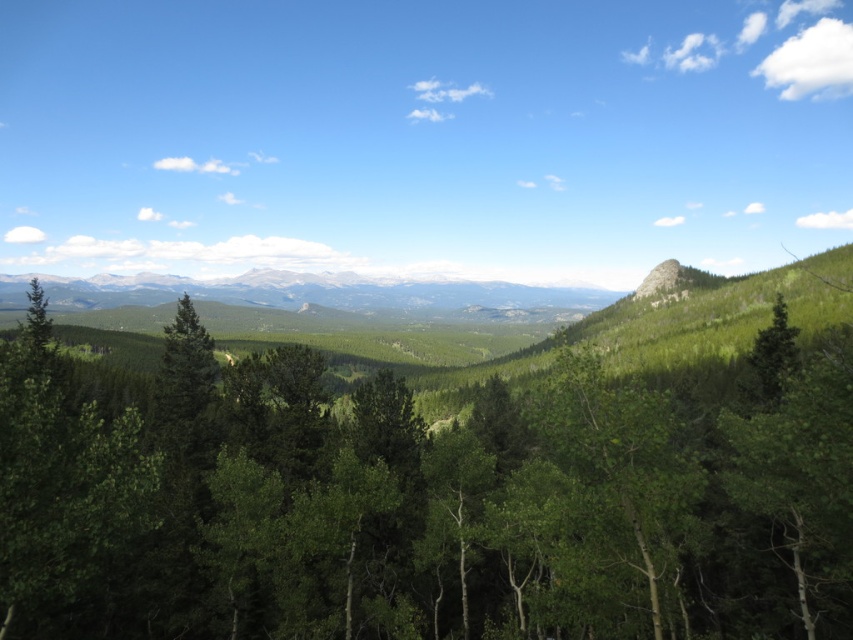
You are an ecologist studying tree distribution in the forest. You observe the green leafy tree at center and the green matte tree at right. Which tree is closer to you based on their positions in the scene?

The green leafy tree at center is closer to you because it is positioned in front of the green matte tree at right.

You are an environmental scientist assessing the landscape. You need to determine which object, the rocky gray mountain range at center or the green matte tree at right, has a greater height. Based on the scene, which one is taller?

The rocky gray mountain range at center has a greater height compared to the green matte tree at right, so the mountain range is taller.